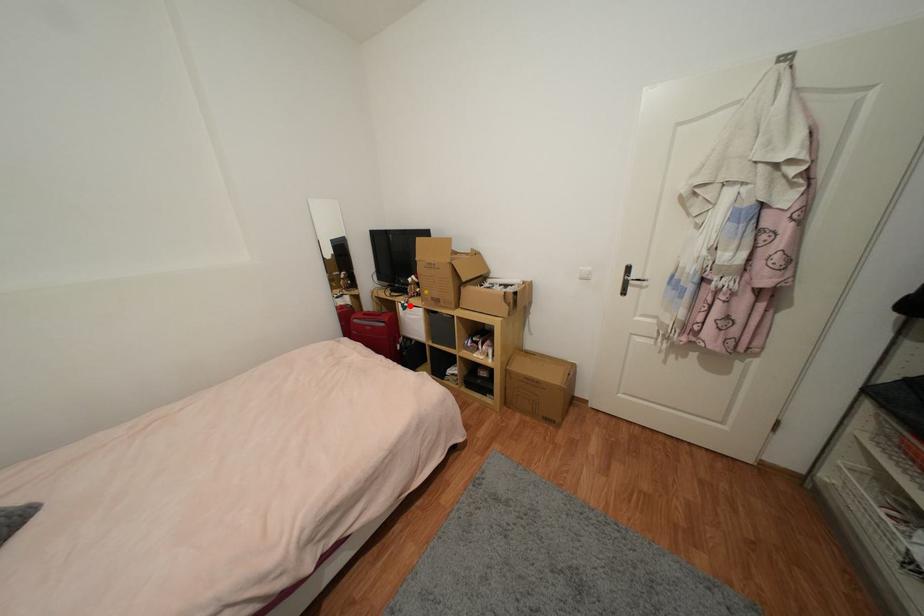
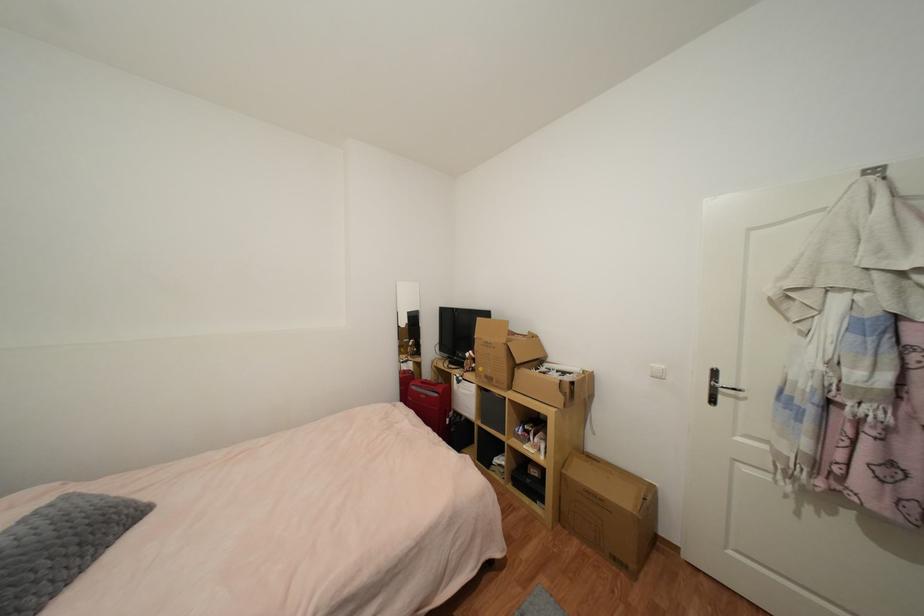
Where in the second image is the point corresponding to the highlighted location from the first image?

(465, 379)